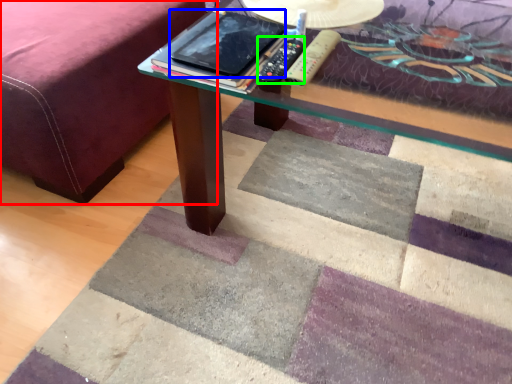
Question: Which object is the farthest from bed frame (highlighted by a red box)? Choose among these: tablet computer (highlighted by a blue box) or remote (highlighted by a green box).

Choices:
 (A) tablet computer
 (B) remote

Answer: (B)